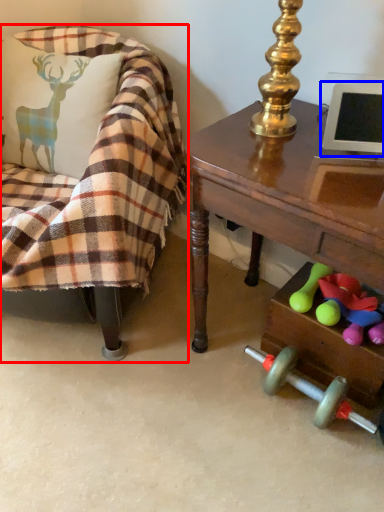
Question: Which of the following is the closest to the observer, chair (highlighted by a red box) or computer monitor (highlighted by a blue box)?

Choices:
 (A) chair
 (B) computer monitor

Answer: (A)